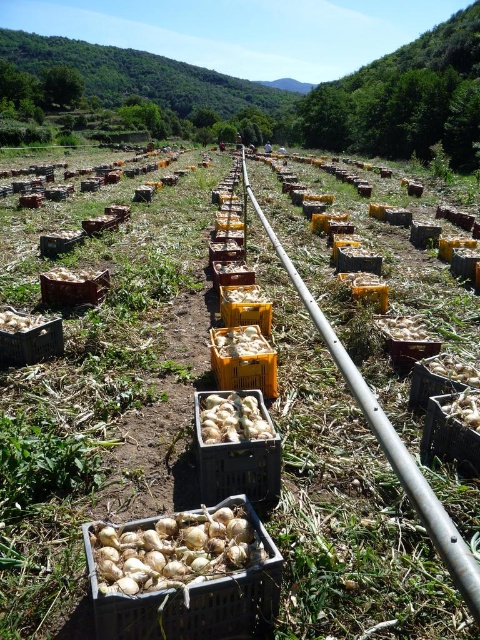
You are a farmer standing at the edge of the field. You need to move from the yellow plastic crate at center to the brown woven basket at lower right. Which direction should you move to get closer to the basket?

To get closer to the brown woven basket at lower right, you should move away from the yellow plastic crate at center since it is closer to you than the basket, which is further back in the field.

You are a farmer who needs to store some onions temporarily. You have a matte plastic basket at center and a black plastic crate at lower right available. Which container should you choose if you want to store onions that need to be kept upright?

The matte plastic basket at center is taller than the black plastic crate at lower right, so it would be better to use the matte plastic basket at center to store onions that need to be kept upright because of its greater height.

You are a farmer checking the onion crates in the field. You need to determine which container has a greater height between the yellow plastic crate at center and the brown woven basket at lower right. Which one is taller?

The yellow plastic crate at center is taller than the brown woven basket at lower right according to the description.